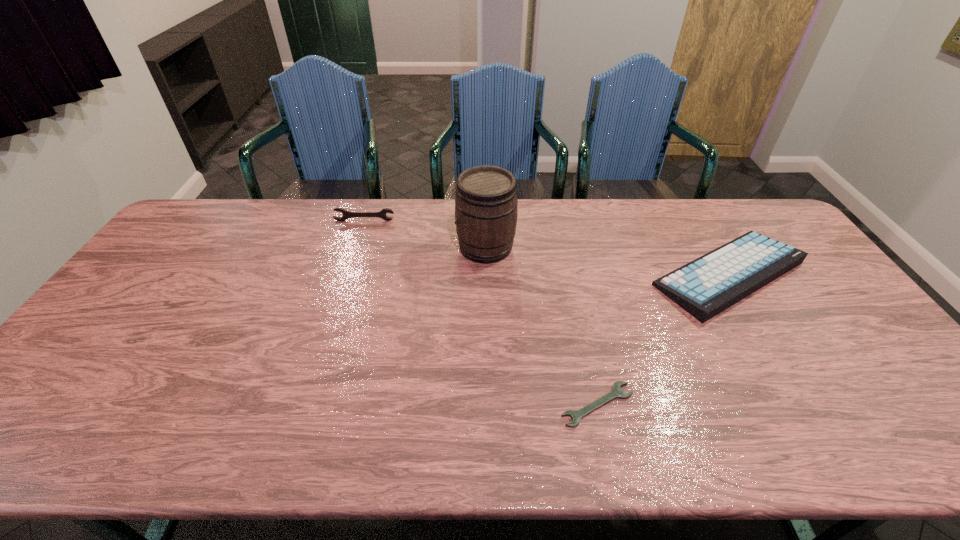
This screenshot has height=540, width=960. What are the coordinates of `the tallest object` in the screenshot? It's located at (486, 210).

You are a GUI agent. You are given a task and a screenshot of the screen. Output one action in this format:
    pyautogui.click(x=<x>, y=<y>)
    Task: Click on the third object from right to left
    The height and width of the screenshot is (540, 960).
    Given the screenshot: What is the action you would take?
    pyautogui.click(x=486, y=210)

Locate an element on the screen. This screenshot has width=960, height=540. the left wrench is located at coordinates (346, 214).

Where is `the taller wrench`? the taller wrench is located at coordinates (346, 214).

The image size is (960, 540). Identify the location of computer keyboard. (710, 284).

Image resolution: width=960 pixels, height=540 pixels. Find the location of `the third object from left to right`. the third object from left to right is located at coordinates (576, 415).

Where is `the nearest object`? the nearest object is located at coordinates (576, 415).

At what (x,y) coordinates should I click in order to perform the action: click on vacant region located on the front of the tallest object. Please return your answer as a coordinate pair (x, y). Looking at the image, I should click on (487, 331).

Image resolution: width=960 pixels, height=540 pixels. In order to click on vacant area situated on the open ends of the taller wrench in this screenshot , I will do `click(348, 271)`.

In order to click on vacant space located on the left of the rightmost object in this screenshot , I will do `click(572, 274)`.